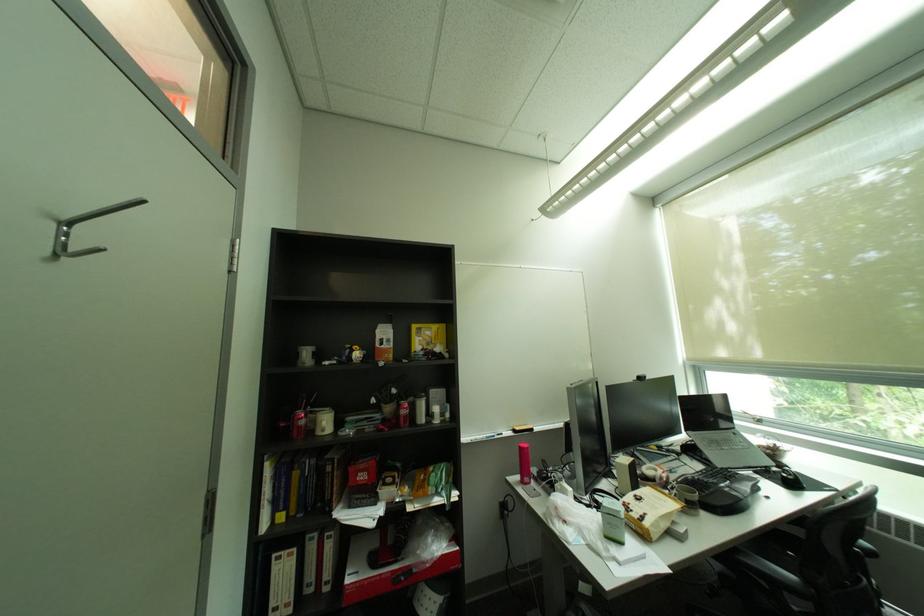
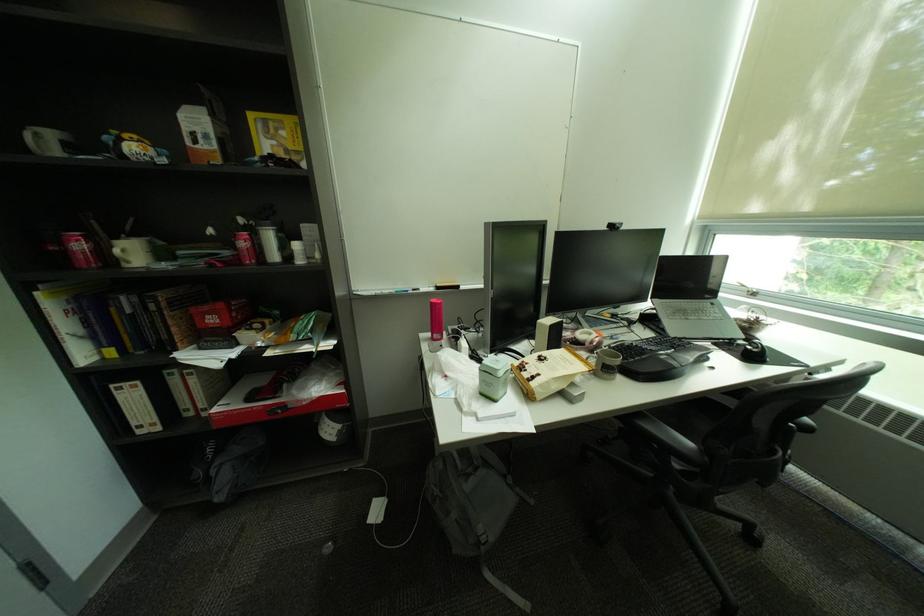
Which direction would the cameraman need to move to produce the second image?

The movement direction of the cameraman is right, forward.